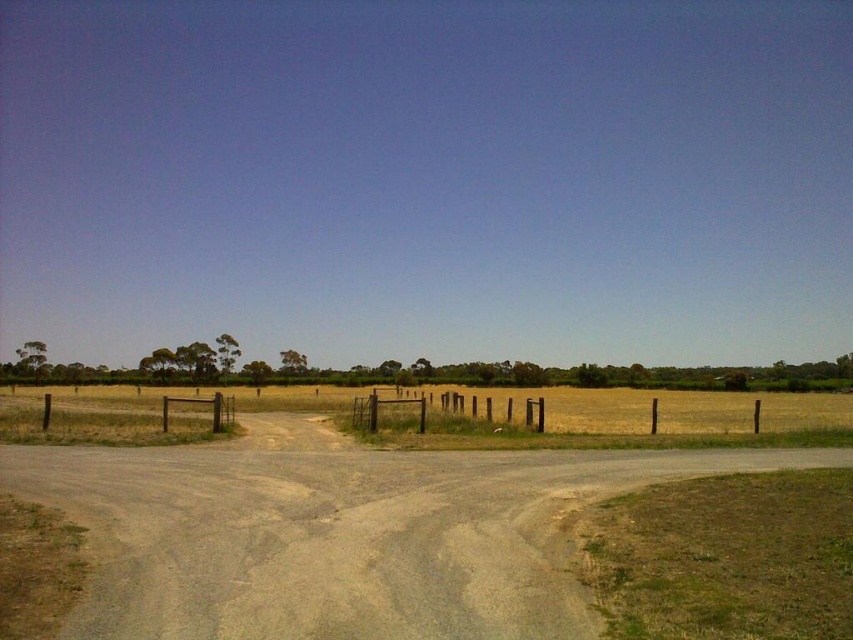
Is point (474, 500) less distant than point (508, 416)?

Yes, point (474, 500) is closer to viewer.

Who is shorter, dull gray gravel at center or brown wooden fence at center?

Standing shorter between the two is dull gray gravel at center.

Identify the location of dull gray gravel at center. (x=340, y=532).

Can you confirm if dull gray gravel at center is positioned above yellow grass at center?

Yes.

How far apart are dull gray gravel at center and yellow grass at center?

A distance of 30.01 meters exists between dull gray gravel at center and yellow grass at center.

Between point (109, 596) and point (701, 422), which one is positioned behind?

Positioned behind is point (701, 422).

Where is `dull gray gravel at center`? dull gray gravel at center is located at coordinates (340, 532).

Does yellow grass at center have a larger size compared to brown wooden fence at center?

Correct, yellow grass at center is larger in size than brown wooden fence at center.

Is yellow grass at center positioned behind brown wooden fence at center?

Result: That is False.

Which is in front, point (809, 420) or point (363, 428)?

Point (363, 428) is in front.

You are a GUI agent. You are given a task and a screenshot of the screen. Output one action in this format:
    pyautogui.click(x=<x>, y=<y>)
    Task: Click on the yellow grass at center
    
    Given the screenshot: What is the action you would take?
    pyautogui.click(x=691, y=412)